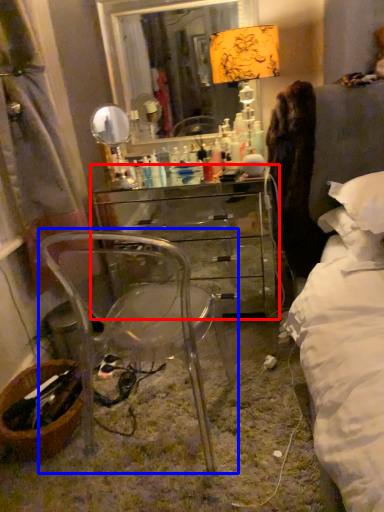
Question: Which object is closer to the camera taking this photo, chest of drawers (highlighted by a red box) or chair (highlighted by a blue box)?

Choices:
 (A) chest of drawers
 (B) chair

Answer: (B)